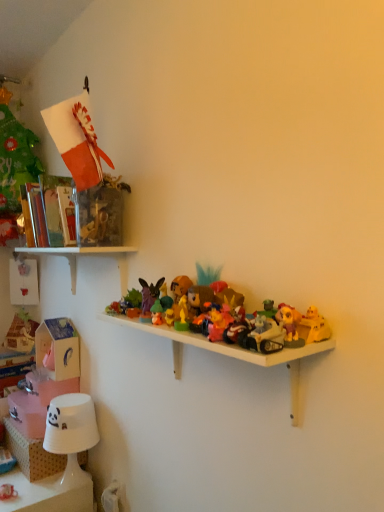
Question: From the image's perspective, is white plastic shelf at center, which is counted as the 2th shelf, starting from the bottom, located beneath matte plastic toy at center, the fifth toy viewed from the left?

Choices:
 (A) yes
 (B) no

Answer: (A)

Question: Is white plastic shelf at center, which is counted as the 2th shelf, starting from the bottom, oriented away from matte plastic toy at center, the fifth toy viewed from the front?

Choices:
 (A) yes
 (B) no

Answer: (B)

Question: Would you consider white plastic shelf at center, the 2th shelf positioned from the top, to be distant from matte plastic toy at center, arranged as the fourth toy when viewed from the back?

Choices:
 (A) no
 (B) yes

Answer: (A)

Question: Considering the relative sizes of white plastic shelf at center, the 2th shelf positioned from the top, and matte plastic toy at center, the fourth toy in the right-to-left sequence, in the image provided, is white plastic shelf at center, the 2th shelf positioned from the top, shorter than matte plastic toy at center, the fourth toy in the right-to-left sequence,?

Choices:
 (A) no
 (B) yes

Answer: (A)

Question: From a real-world perspective, is white plastic shelf at center, which is counted as the 2th shelf, starting from the bottom, positioned over matte plastic toy at center, arranged as the fourth toy when viewed from the back, based on gravity?

Choices:
 (A) no
 (B) yes

Answer: (A)

Question: Based on their positions, is multicolored plastic toy at center, which is the fourth toy in bottom-to-top order, located to the left or right of green matte figurine at center, the 7th toy viewed from the top?

Choices:
 (A) left
 (B) right

Answer: (B)

Question: In the image, is multicolored plastic toy at center, the sixth toy from the back, positioned in front of or behind green matte figurine at center, which is the 2th toy from bottom to top?

Choices:
 (A) front
 (B) behind

Answer: (A)

Question: In terms of width, does multicolored plastic toy at center, arranged as the third toy when viewed from the right, look wider or thinner when compared to green matte figurine at center, placed as the fourth toy when sorted from front to back?

Choices:
 (A) wide
 (B) thin

Answer: (A)

Question: Is point (221, 310) positioned closer to the camera than point (162, 320)?

Choices:
 (A) farther
 (B) closer

Answer: (B)

Question: Is white plastic shelf at center, which is counted as the 2th shelf, starting from the bottom, bigger or smaller than shiny plastic motorcycle at center, marked as the seventh toy in a left-to-right arrangement?

Choices:
 (A) big
 (B) small

Answer: (A)

Question: Do you think white plastic shelf at center, which is counted as the 2th shelf, starting from the bottom, is within shiny plastic motorcycle at center, the first toy from the front, or outside of it?

Choices:
 (A) inside
 (B) outside

Answer: (B)

Question: Is white plastic shelf at center, the 2th shelf positioned from the top, taller or shorter than shiny plastic motorcycle at center, acting as the second toy starting from the right?

Choices:
 (A) tall
 (B) short

Answer: (A)

Question: Considering the relative positions of white plastic shelf at center, which is counted as the 2th shelf, starting from the bottom, and shiny plastic motorcycle at center, marked as the seventh toy in a left-to-right arrangement, in the image provided, is white plastic shelf at center, which is counted as the 2th shelf, starting from the bottom, to the left or to the right of shiny plastic motorcycle at center, marked as the seventh toy in a left-to-right arrangement,?

Choices:
 (A) right
 (B) left

Answer: (B)

Question: Relative to matte plastic toy at center, the fifth toy viewed from the left, is white paper lampshade at lower left in front or behind?

Choices:
 (A) behind
 (B) front

Answer: (A)

Question: From a real-world perspective, relative to matte plastic toy at center, placed as the eighth toy when sorted from bottom to top, is white paper lampshade at lower left vertically above or below?

Choices:
 (A) above
 (B) below

Answer: (B)